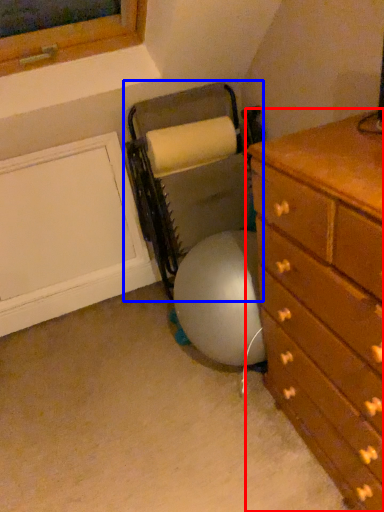
Question: Which point is closer to the camera, chest of drawers (highlighted by a red box) or bean bag chair (highlighted by a blue box)?

Choices:
 (A) chest of drawers
 (B) bean bag chair

Answer: (A)